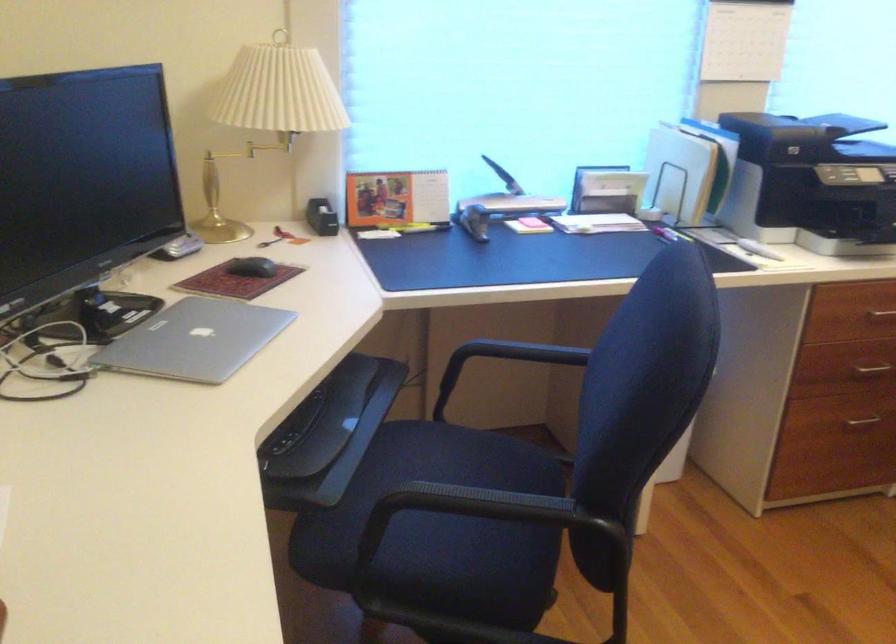
Which object does [502,205] point to?

This point indicates the grey stapler.